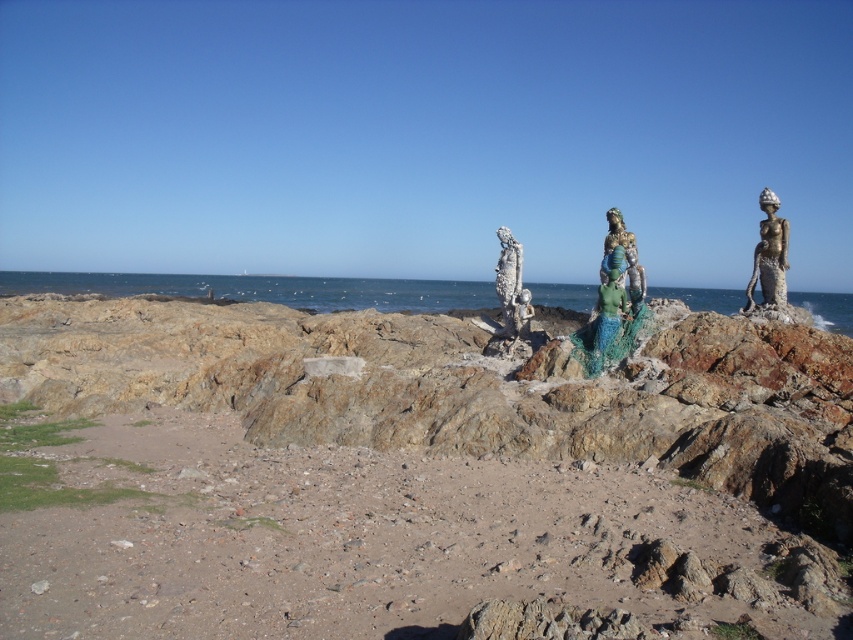
Can you confirm if rusty metal statue at center is taller than green patina statue at center?

In fact, rusty metal statue at center may be shorter than green patina statue at center.

Does rusty metal statue at center lie in front of green patina statue at center?

No, rusty metal statue at center is behind green patina statue at center.

Where is `rusty metal statue at center`? The height and width of the screenshot is (640, 853). rusty metal statue at center is located at coordinates (511, 300).

I want to click on rusty metal statue at center, so click(511, 300).

Does green patina statue at center lie behind green fabric mermaid at center?

Yes, it is behind green fabric mermaid at center.

Who is taller, green patina statue at center or green fabric mermaid at center?

green patina statue at center is taller.

Is point (636, 289) closer to camera compared to point (602, 337)?

No, (636, 289) is behind (602, 337).

Identify the location of green patina statue at center. The image size is (853, 640). (625, 257).

Is brown sandy beach at lower left below shiny bronze mermaid at right?

Yes.

Between brown sandy beach at lower left and shiny bronze mermaid at right, which one has less height?

With less height is brown sandy beach at lower left.

Does point (245, 552) come in front of point (775, 227)?

Yes, point (245, 552) is closer to viewer.

Identify the location of brown sandy beach at lower left. (366, 541).